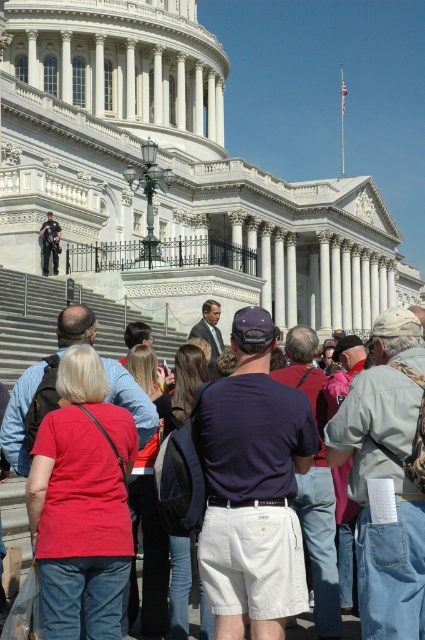
You are a photographer trying to capture a photo of the United States Capitol building. You notice two people in the foreground who might obstruct your shot. The denim jacket at lower right and the red fabric shirt at center are both in your frame. Which of these two is larger in size and might block more of the view?

The denim jacket at lower right is larger in size compared to the red fabric shirt at center, so it might block more of the view.